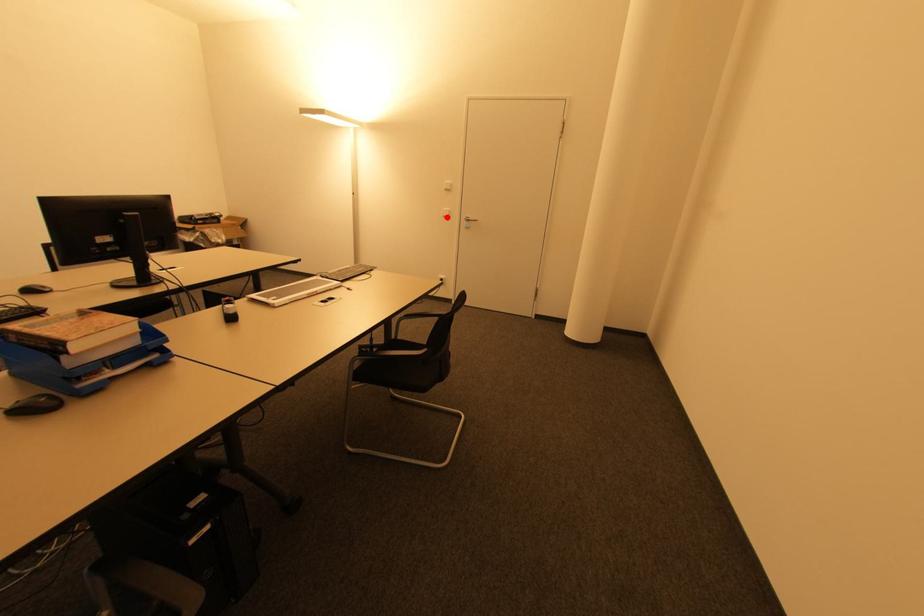
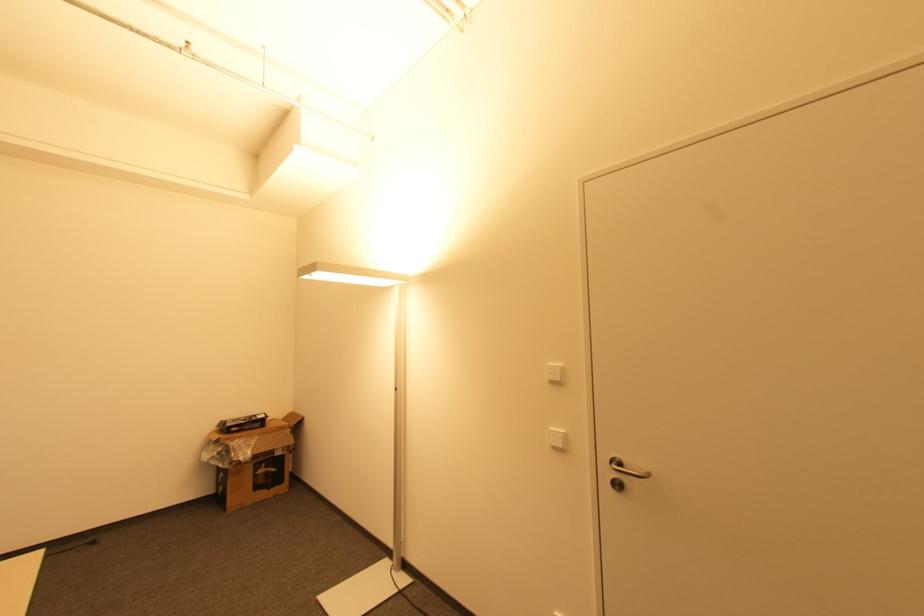
Locate, in the second image, the point that corresponds to the highlighted location in the first image.

(557, 448)